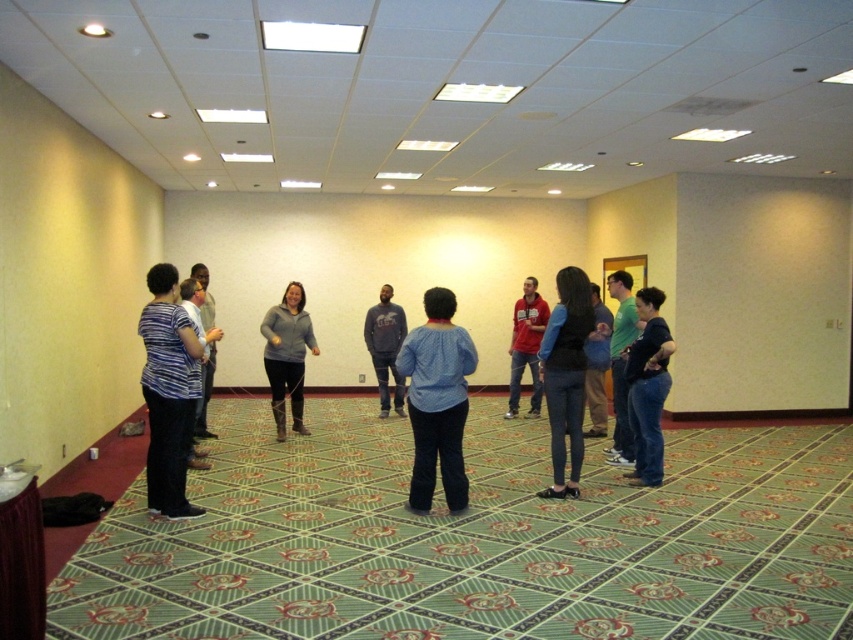
You are standing in the room and see the blue jeans at lower right and the red cotton shirt at center. Which clothing item is positioned more to the east side of the room?

The blue jeans at lower right are to the right of the red cotton shirt at center, so they are positioned more to the east side of the room.

You are organizing a photo shoot and need to ensure that all clothing items in the image are clearly visible. Given that the blue jeans at lower right and the gray sweater at center are both important elements, which clothing item might require more careful framing to ensure it is fully captured in the photo?

The blue jeans at lower right occupies less space than gray sweater at center, so the blue jeans at lower right might require more careful framing to ensure it is fully captured in the photo.

You are standing in the room and want to hand a document to the person wearing the red cotton shirt at center. However, there is an obstacle between you and them. Which direction should you move to avoid the blue jeans at lower right?

The blue jeans at lower right is below the red cotton shirt at center, so you should move to the upper area to avoid the blue jeans at lower right and reach the red cotton shirt at center.